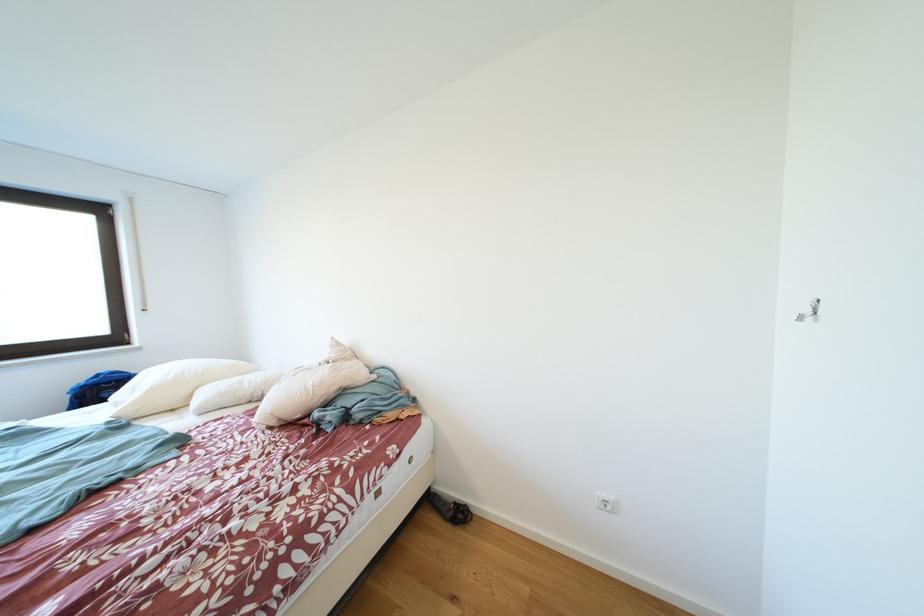
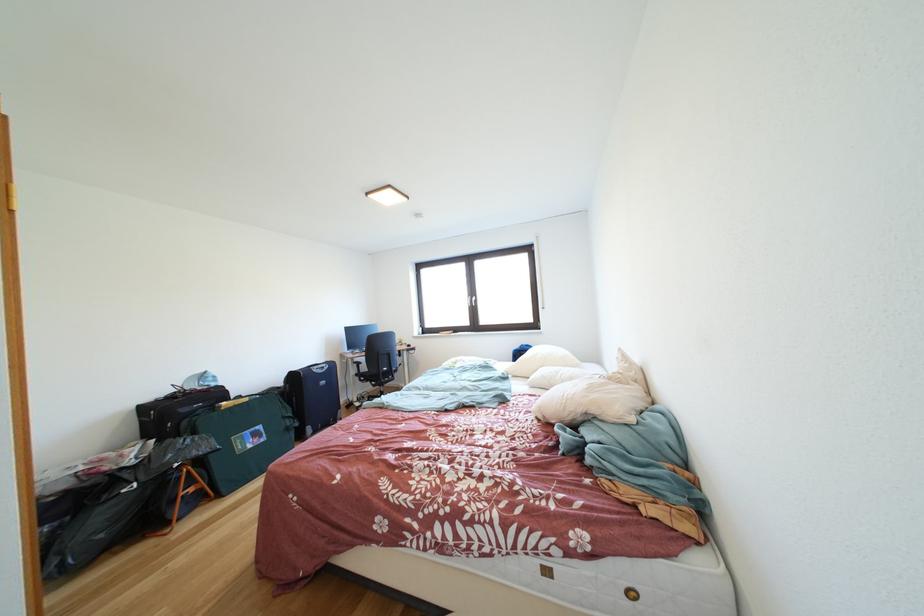
Question: The first image is from the beginning of the video and the second image is from the end. How did the camera likely rotate when shooting the video?

Choices:
 (A) Left
 (B) Right
 (C) Up
 (D) Down

Answer: (A)